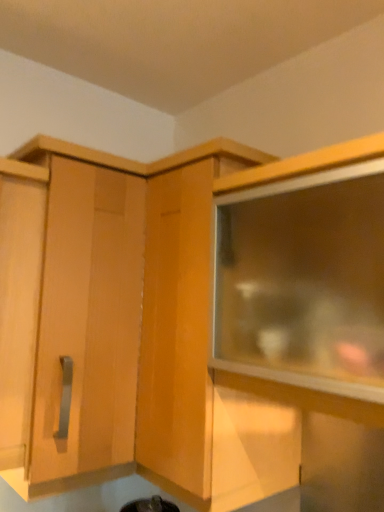
Question: Is matte wood cabinet at upper left, placed as the first cabinetry when sorted from left to right, looking in the opposite direction of transparent glass cabinet at upper right?

Choices:
 (A) no
 (B) yes

Answer: (A)

Question: From a real-world perspective, does matte wood cabinet at upper left, the 2th cabinetry viewed from the right, stand above transparent glass cabinet at upper right?

Choices:
 (A) no
 (B) yes

Answer: (A)

Question: Is matte wood cabinet at upper left, the 2th cabinetry viewed from the right, positioned behind transparent glass cabinet at upper right?

Choices:
 (A) yes
 (B) no

Answer: (A)

Question: From the image's perspective, does matte wood cabinet at upper left, placed as the first cabinetry when sorted from left to right, appear lower than transparent glass cabinet at upper right?

Choices:
 (A) no
 (B) yes

Answer: (B)

Question: Can you confirm if matte wood cabinet at upper left, the 2th cabinetry viewed from the right, is shorter than transparent glass cabinet at upper right?

Choices:
 (A) no
 (B) yes

Answer: (A)

Question: Does matte wood cabinet at upper left, placed as the first cabinetry when sorted from left to right, come in front of transparent glass cabinet at upper right?

Choices:
 (A) no
 (B) yes

Answer: (A)

Question: Considering the relative sizes of transparent glass cabinet at upper right and wooden cabinet at center, the 1th cabinetry viewed from the right, in the image provided, is transparent glass cabinet at upper right taller than wooden cabinet at center, the 1th cabinetry viewed from the right,?

Choices:
 (A) no
 (B) yes

Answer: (A)

Question: Does transparent glass cabinet at upper right come behind wooden cabinet at center, the 1th cabinetry viewed from the right?

Choices:
 (A) no
 (B) yes

Answer: (A)

Question: From the image's perspective, is transparent glass cabinet at upper right below wooden cabinet at center, the 1th cabinetry viewed from the right?

Choices:
 (A) yes
 (B) no

Answer: (B)

Question: Can you confirm if transparent glass cabinet at upper right is shorter than wooden cabinet at center, the 1th cabinetry viewed from the right?

Choices:
 (A) no
 (B) yes

Answer: (B)

Question: Is transparent glass cabinet at upper right with wooden cabinet at center, the 1th cabinetry viewed from the right?

Choices:
 (A) yes
 (B) no

Answer: (B)

Question: From a real-world perspective, is transparent glass cabinet at upper right physically below wooden cabinet at center, the 1th cabinetry viewed from the right?

Choices:
 (A) no
 (B) yes

Answer: (A)

Question: Is transparent glass cabinet at upper right located within wooden cabinet at center, the 1th cabinetry viewed from the right?

Choices:
 (A) no
 (B) yes

Answer: (A)